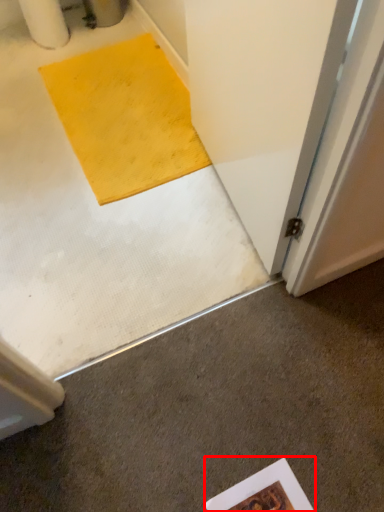
Question: Where is writing (annotated by the red box) located in relation to concrete in the image?

Choices:
 (A) left
 (B) right

Answer: (B)